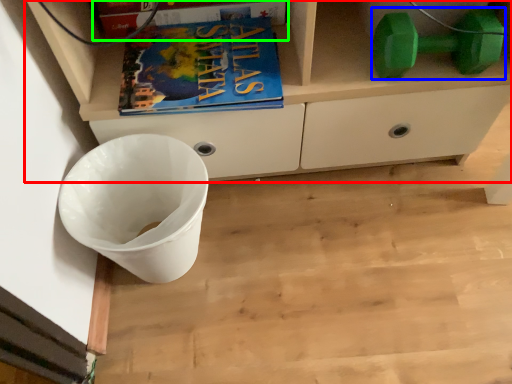
Question: Which object is positioned farthest from cabinetry (highlighted by a red box)? Select from dumbbell (highlighted by a blue box) and paperback book (highlighted by a green box).

Choices:
 (A) dumbbell
 (B) paperback book

Answer: (B)